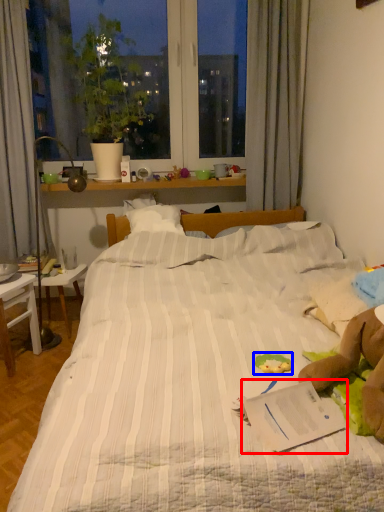
Question: Which of the following is the closest to the observer, paperback book (highlighted by a red box) or stuff (highlighted by a blue box)?

Choices:
 (A) paperback book
 (B) stuff

Answer: (A)